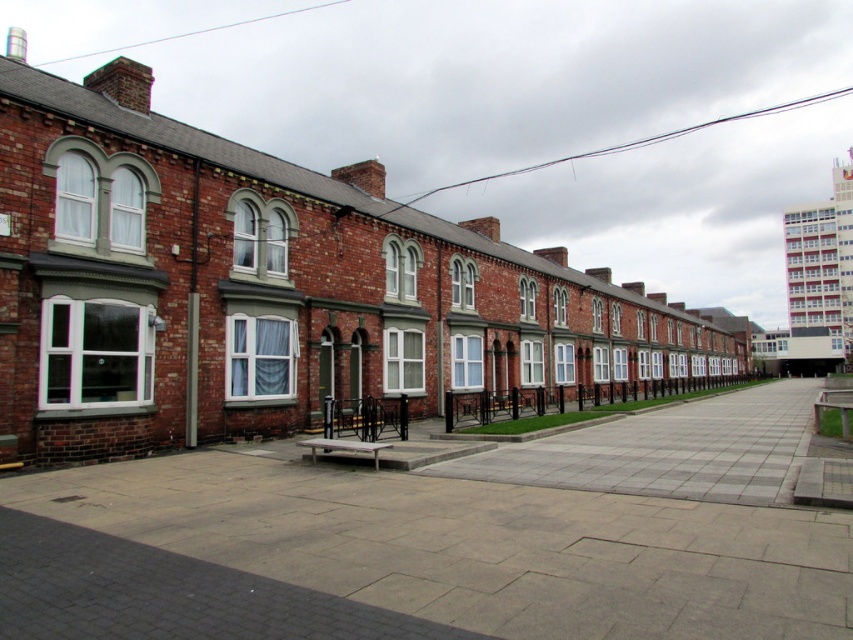
Question: In this image, where is gray concrete pavement at center located relative to brick wall at center?

Choices:
 (A) above
 (B) below

Answer: (A)

Question: From the image, what is the correct spatial relationship of gray concrete pavement at center in relation to brick wall at center?

Choices:
 (A) left
 (B) right

Answer: (A)

Question: Among these points, which one is farthest from the camera?

Choices:
 (A) (x=798, y=467)
 (B) (x=410, y=628)

Answer: (A)

Question: Is gray concrete pavement at center to the right of brick wall at center from the viewer's perspective?

Choices:
 (A) no
 (B) yes

Answer: (A)